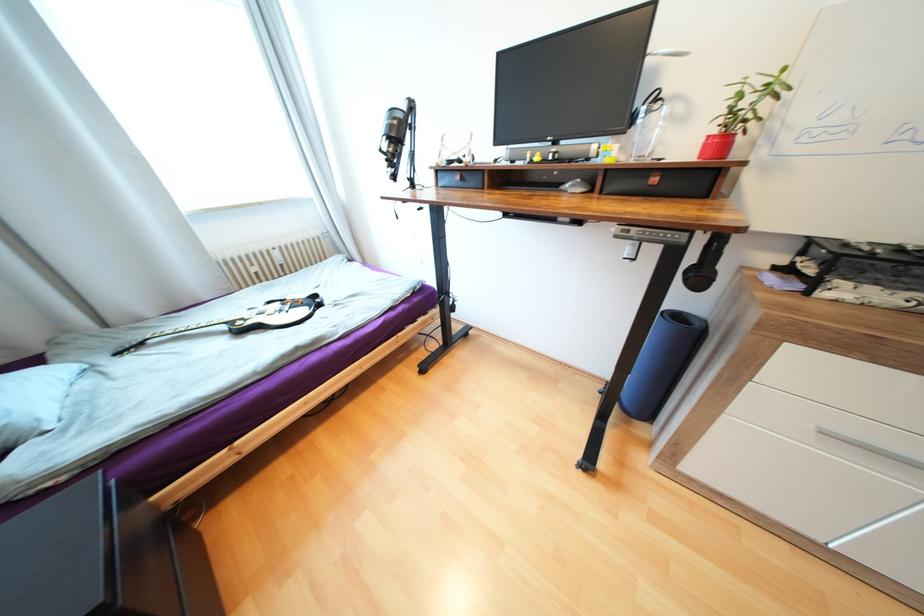
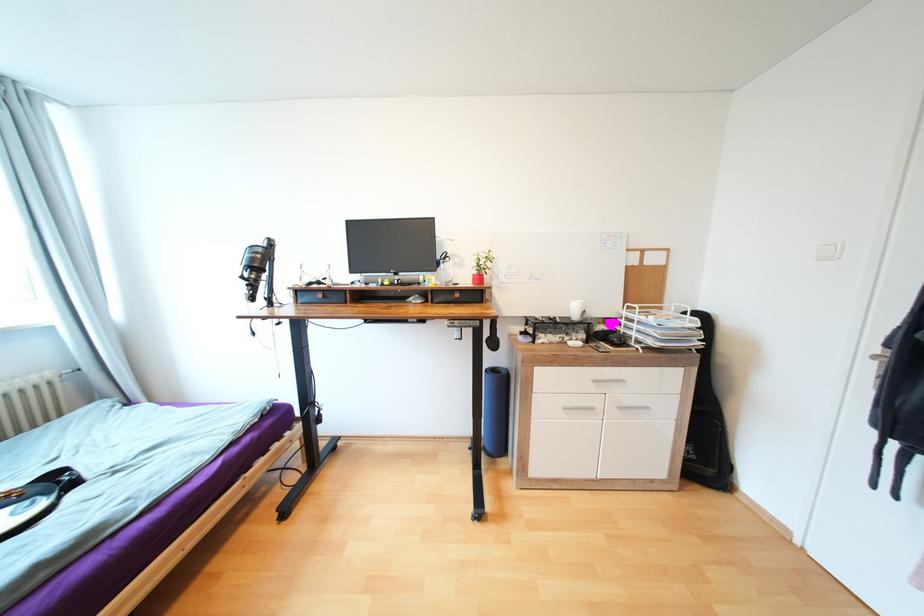
First-person continuous shooting, in which direction is the camera rotating?

The camera rotated toward right-up.